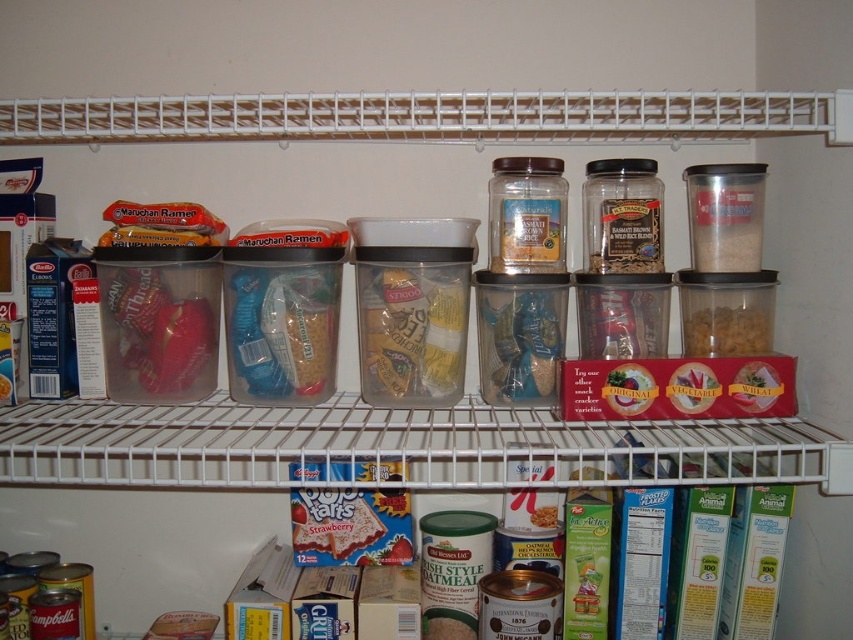
Question: Which of the following is the closest to the observer?

Choices:
 (A) (691, 355)
 (B) (358, 280)
 (C) (486, 289)

Answer: (C)

Question: Does translucent plastic bag of candy at center appear over brown matte cereal at center right?

Choices:
 (A) no
 (B) yes

Answer: (A)

Question: Which object is the farthest from the translucent glass jar at center?

Choices:
 (A) translucent plastic bag of candy at center
 (B) brown matte cereal at center right

Answer: (B)

Question: Which of the following is the closest to the observer?

Choices:
 (A) pos(757,196)
 (B) pos(544,291)
 (C) pos(16,120)

Answer: (C)

Question: Does clear plastic containers at center have a greater width compared to translucent plastic bag of candy at center?

Choices:
 (A) no
 (B) yes

Answer: (B)

Question: Can you confirm if translucent glass jar at center is thinner than translucent plastic jar at center?

Choices:
 (A) yes
 (B) no

Answer: (B)